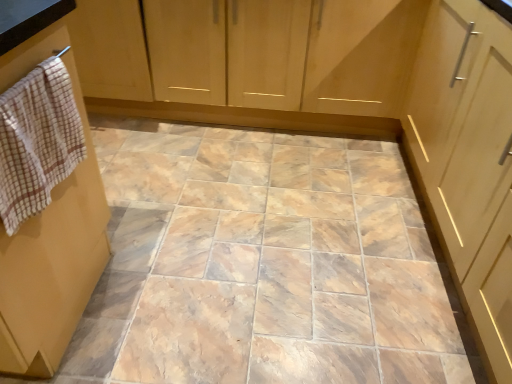
This screenshot has width=512, height=384. What do you see at coordinates (252, 61) in the screenshot?
I see `wooden cabinet at upper left` at bounding box center [252, 61].

I want to click on wooden cabinet at upper left, so click(252, 61).

What do you see at coordinates (37, 141) in the screenshot? I see `white checkered hand towel at left` at bounding box center [37, 141].

What is the approximate height of white checkered hand towel at left?

white checkered hand towel at left is 31.74 centimeters in height.

Where is `white checkered hand towel at left`? The width and height of the screenshot is (512, 384). white checkered hand towel at left is located at coordinates (37, 141).

What are the coordinates of `wooden cabinet at upper left` in the screenshot? It's located at (252, 61).

Is white checkered hand towel at left to the left or to the right of wooden cabinet at upper left in the image?

white checkered hand towel at left is to the left of wooden cabinet at upper left.

Which object is closer to the camera taking this photo, white checkered hand towel at left or wooden cabinet at upper left?

Positioned in front is white checkered hand towel at left.

Based on the photo, which point is more forward, (39, 150) or (395, 98)?

Positioned in front is point (39, 150).

From the image's perspective, is white checkered hand towel at left above wooden cabinet at upper left?

No, from the image's perspective, white checkered hand towel at left is not on top of wooden cabinet at upper left.

From a real-world perspective, is white checkered hand towel at left positioned under wooden cabinet at upper left based on gravity?

Incorrect, from a real-world perspective, white checkered hand towel at left is higher than wooden cabinet at upper left.

Based on the photo, is white checkered hand towel at left thinner than wooden cabinet at upper left?

Yes.

Consider the image. Is white checkered hand towel at left taller than wooden cabinet at upper left?

No, white checkered hand towel at left is not taller than wooden cabinet at upper left.

Considering the sizes of objects white checkered hand towel at left and wooden cabinet at upper left in the image provided, who is smaller, white checkered hand towel at left or wooden cabinet at upper left?

Smaller between the two is white checkered hand towel at left.

Would you say white checkered hand towel at left contains wooden cabinet at upper left?

No, white checkered hand towel at left does not contain wooden cabinet at upper left.

Would you consider white checkered hand towel at left to be distant from wooden cabinet at upper left?

white checkered hand towel at left is far away from wooden cabinet at upper left.

Could you tell me if white checkered hand towel at left is turned towards wooden cabinet at upper left?

Yes, white checkered hand towel at left is oriented towards wooden cabinet at upper left.

What's the angular difference between white checkered hand towel at left and wooden cabinet at upper left's facing directions?

179 degrees.

This screenshot has width=512, height=384. What are the coordinates of `cabinetry located on the right of white checkered hand towel at left` in the screenshot? It's located at (252, 61).

Between wooden cabinet at upper left and white checkered hand towel at left, which one appears on the right side from the viewer's perspective?

wooden cabinet at upper left is more to the right.

In the scene shown: In the image, is wooden cabinet at upper left positioned in front of or behind white checkered hand towel at left?

wooden cabinet at upper left is behind white checkered hand towel at left.

Is point (117, 27) behind point (14, 161)?

Yes, it is.

From the image's perspective, is wooden cabinet at upper left above or below white checkered hand towel at left?

wooden cabinet at upper left is situated higher than white checkered hand towel at left in the image.

From a real-world perspective, which object rests below the other?

In real-world perspective, wooden cabinet at upper left is lower.

Between wooden cabinet at upper left and white checkered hand towel at left, which one has smaller width?

Thinner between the two is white checkered hand towel at left.

Looking at this image, is wooden cabinet at upper left shorter than white checkered hand towel at left?

In fact, wooden cabinet at upper left may be taller than white checkered hand towel at left.

Is wooden cabinet at upper left bigger than white checkered hand towel at left?

Correct, wooden cabinet at upper left is larger in size than white checkered hand towel at left.

Is wooden cabinet at upper left surrounding white checkered hand towel at left?

Actually, white checkered hand towel at left is outside wooden cabinet at upper left.

Is wooden cabinet at upper left not close to white checkered hand towel at left?

Indeed, wooden cabinet at upper left is not near white checkered hand towel at left.

Is wooden cabinet at upper left positioned with its back to white checkered hand towel at left?

No, wooden cabinet at upper left is not facing the opposite direction of white checkered hand towel at left.

Measure the distance between wooden cabinet at upper left and white checkered hand towel at left.

They are 4.33 feet apart.

Where is `cabinetry above the white checkered hand towel at left (from the image's perspective)`? The image size is (512, 384). cabinetry above the white checkered hand towel at left (from the image's perspective) is located at coordinates (252, 61).

Find the location of a particular element. This screenshot has height=384, width=512. cabinetry lying above the white checkered hand towel at left (from the image's perspective) is located at coordinates (252, 61).

Image resolution: width=512 pixels, height=384 pixels. I want to click on hand towel below the wooden cabinet at upper left (from the image's perspective), so click(37, 141).